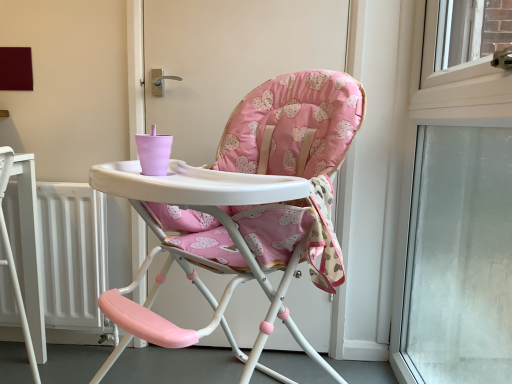
This screenshot has width=512, height=384. What are the coordinates of `vacant area situated below white matte radiator at lower left (from a real-world perspective)` in the screenshot? It's located at (68, 350).